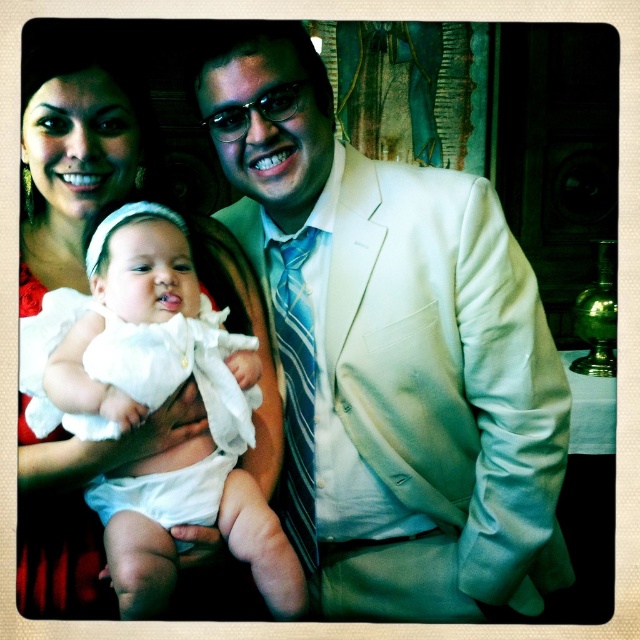
Question: Does white satin suit at center appear on the right side of white satin dress at center?

Choices:
 (A) no
 (B) yes

Answer: (B)

Question: Which object is closer to the camera taking this photo?

Choices:
 (A) white satin suit at center
 (B) white satin dress at center
 (C) blue striped tie at center
 (D) white clothed baby at center

Answer: (B)

Question: Where is white clothed baby at center located in relation to white satin dress at center in the image?

Choices:
 (A) left
 (B) right

Answer: (B)

Question: Does white satin dress at center lie in front of blue striped tie at center?

Choices:
 (A) no
 (B) yes

Answer: (B)

Question: Which point is closer to the camera?

Choices:
 (A) white clothed baby at center
 (B) blue striped tie at center
 (C) white satin suit at center
 (D) white satin dress at center

Answer: (D)

Question: Which point is closer to the camera?

Choices:
 (A) white satin suit at center
 (B) white clothed baby at center

Answer: (B)